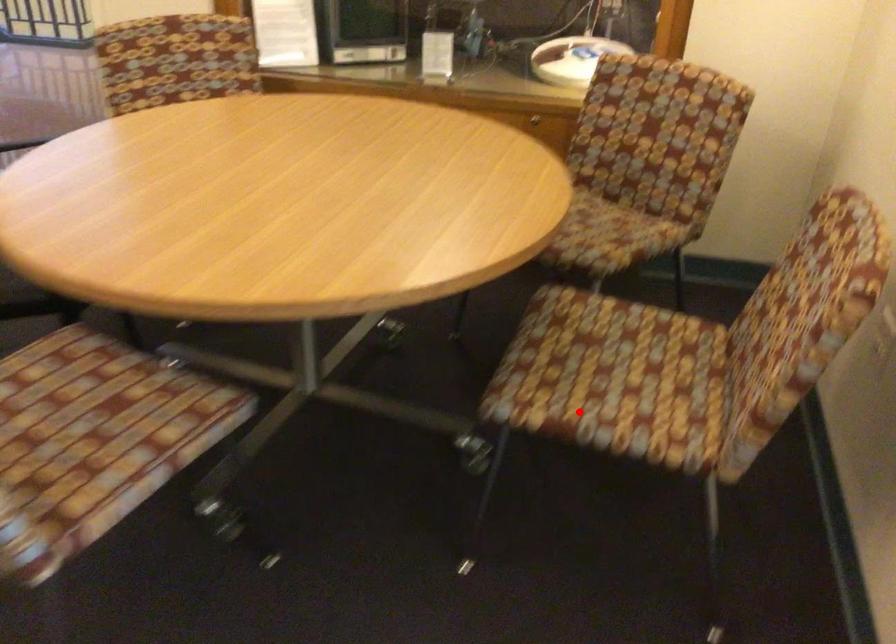
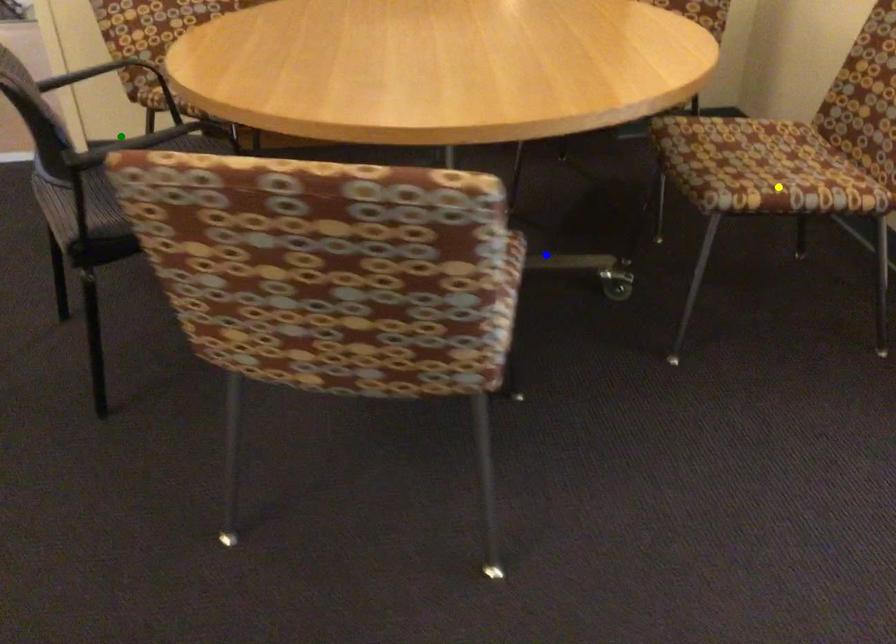
Question: I am providing you with two images of the same scene from different viewpoints. A red point is marked on the first image. You are given multiple points on the second image. Which mark in image 2 goes with the point in image 1?

Choices:
 (A) yellow point
 (B) green point
 (C) blue point

Answer: (A)